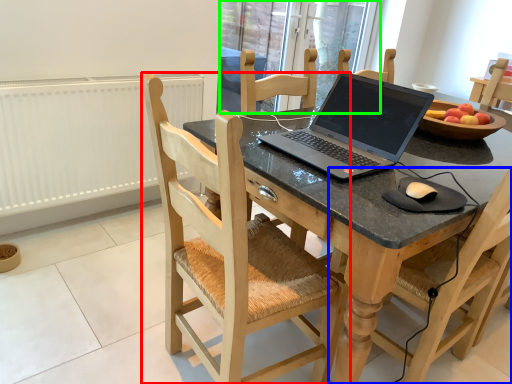
Question: Estimate the real-world distances between objects in this image. Which object is closer to chair (highlighted by a red box), chair (highlighted by a blue box) or glass door (highlighted by a green box)?

Choices:
 (A) chair
 (B) glass door

Answer: (A)